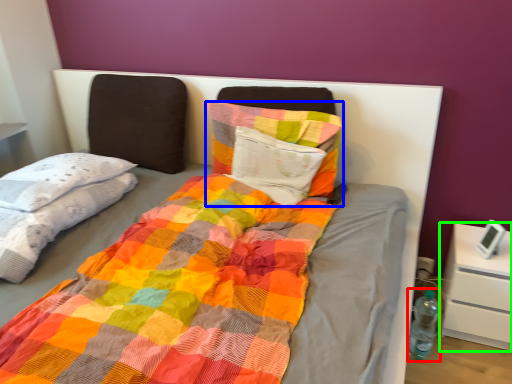
Question: Which object is positioned farthest from bottle (highlighted by a red box)? Select from pillow (highlighted by a blue box) and nightstand (highlighted by a green box).

Choices:
 (A) pillow
 (B) nightstand

Answer: (A)